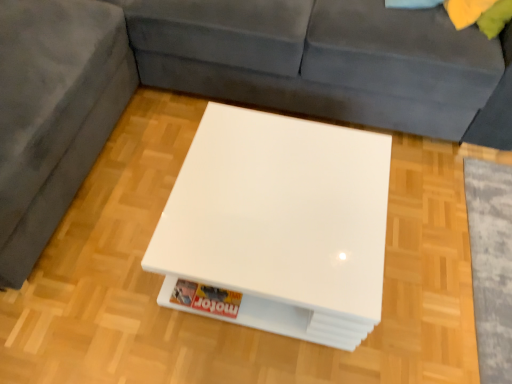
The width and height of the screenshot is (512, 384). Find the location of `white glossy table at center`. white glossy table at center is located at coordinates (280, 223).

Measure the distance between white glossy table at center and camera.

3.36 feet.

The height and width of the screenshot is (384, 512). What do you see at coordinates (280, 223) in the screenshot?
I see `white glossy table at center` at bounding box center [280, 223].

You are a GUI agent. You are given a task and a screenshot of the screen. Output one action in this format:
    pyautogui.click(x=<x>, y=<y>)
    Task: Click on the white glossy table at center
    The height and width of the screenshot is (384, 512).
    Given the screenshot: What is the action you would take?
    pyautogui.click(x=280, y=223)